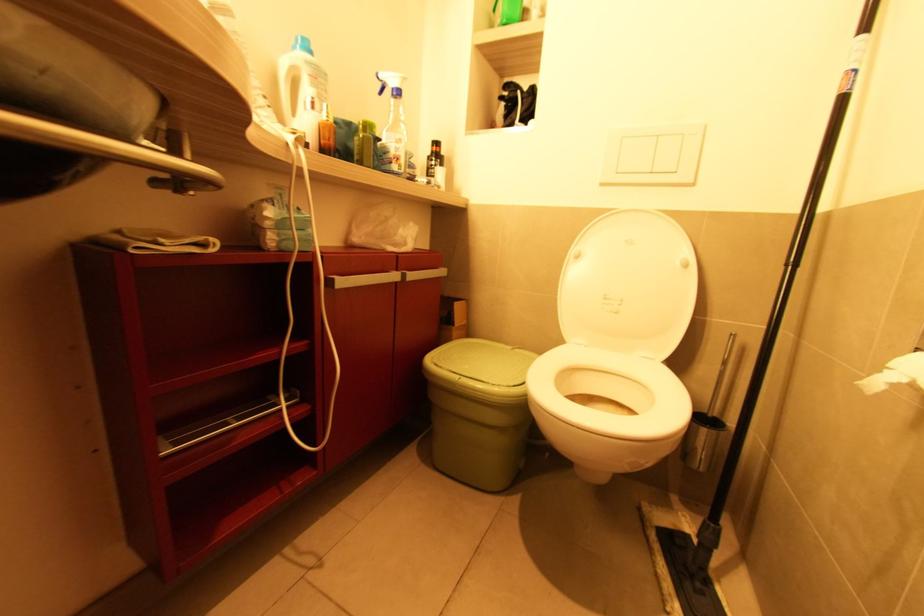
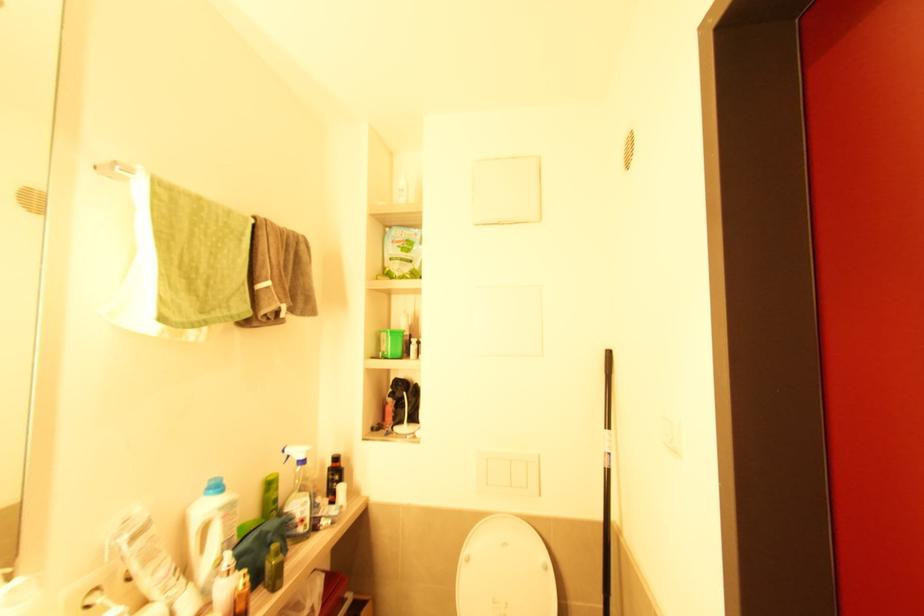
Locate, in the second image, the point that corresponds to (579,257) in the first image.

(469, 561)